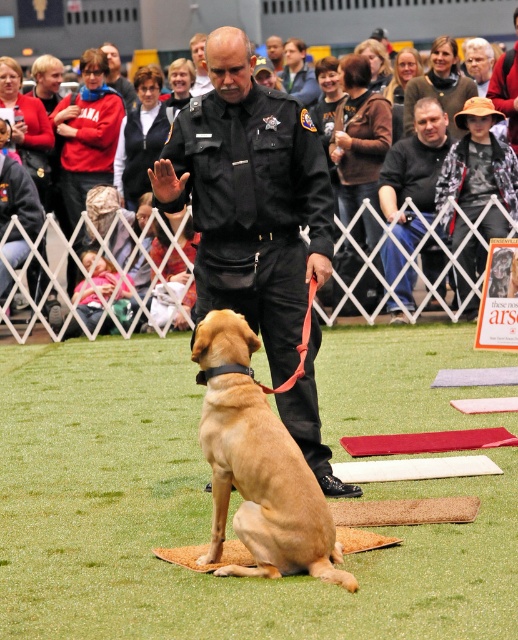
Question: Considering the relative positions of black uniform at center and golden fur dog at center in the image provided, where is black uniform at center located with respect to golden fur dog at center?

Choices:
 (A) below
 (B) above

Answer: (B)

Question: Where is black uniform at center located in relation to red cotton shirt at upper left in the image?

Choices:
 (A) below
 (B) above

Answer: (A)

Question: Does black uniform at center appear under golden fur dog at center?

Choices:
 (A) yes
 (B) no

Answer: (B)

Question: Which point is farther to the camera?

Choices:
 (A) (315, 552)
 (B) (1, 28)
 (C) (293, 412)

Answer: (B)

Question: Which point is farther to the camera?

Choices:
 (A) (251, 436)
 (B) (155, 184)

Answer: (B)

Question: Estimate the real-world distances between objects in this image. Which object is farther from the red cotton shirt at upper left?

Choices:
 (A) golden fur dog at center
 (B) black uniform at center

Answer: (A)